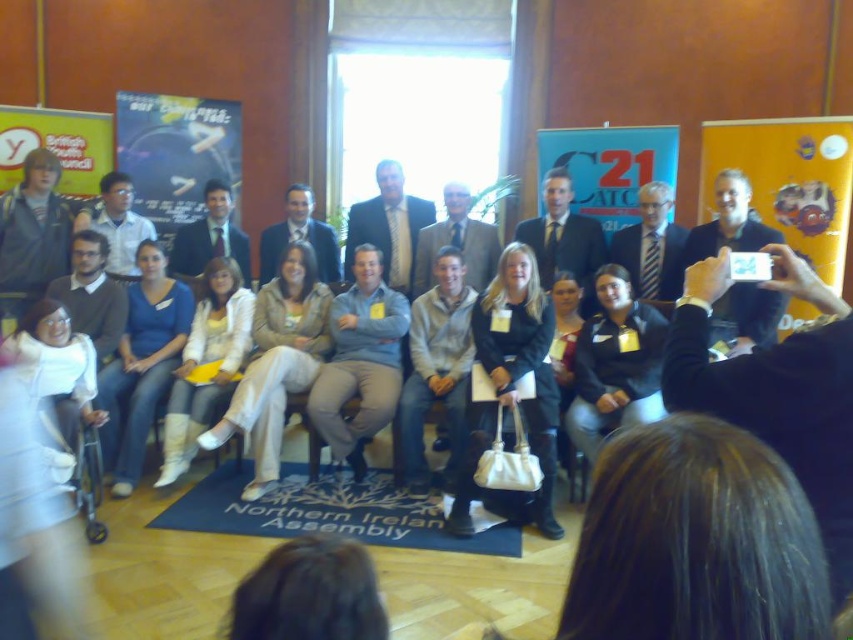
You are a photographer trying to adjust the focus of your camera to capture both the gray cotton shirt at center and the gray fleece jacket at center in the group photo. Which one should you focus on first to ensure the subject closer to the camera is in sharp focus?

The gray cotton shirt at center is located above the gray fleece jacket at center, so you should focus on the gray cotton shirt at center first since it is closer to the camera.